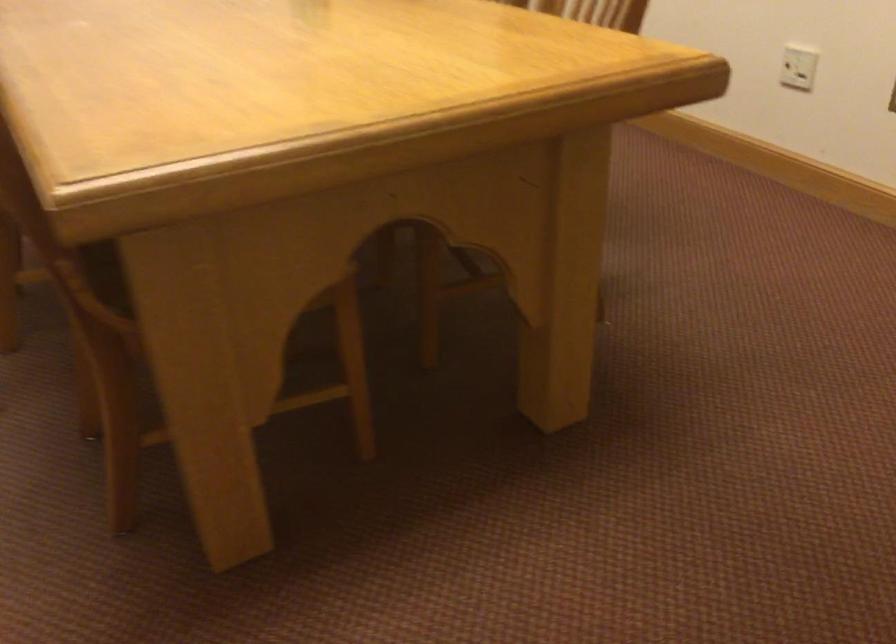
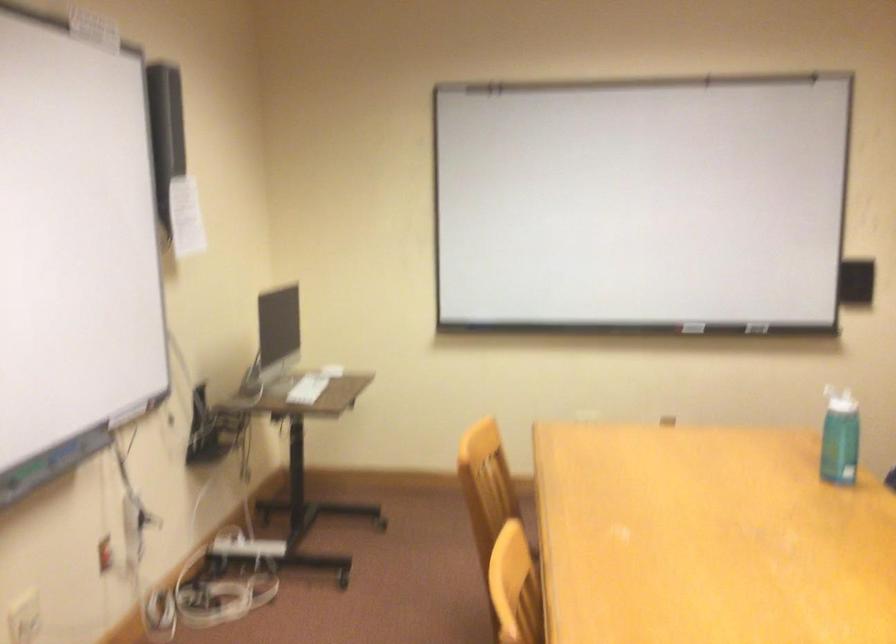
Question: Based on the continuous images, in which direction is the camera rotating? Reply with the corresponding letter.

Choices:
 (A) Left
 (B) Right
 (C) Up
 (D) Down

Answer: (A)